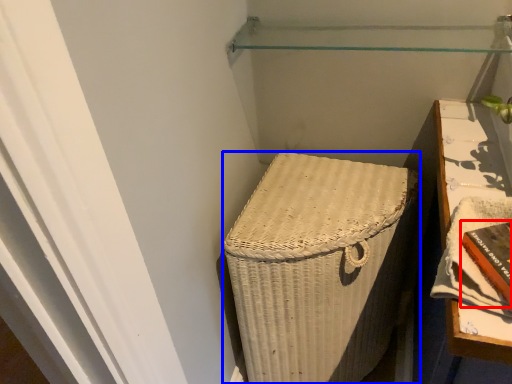
Question: Which object is further to the camera taking this photo, book (highlighted by a red box) or furniture (highlighted by a blue box)?

Choices:
 (A) book
 (B) furniture

Answer: (B)